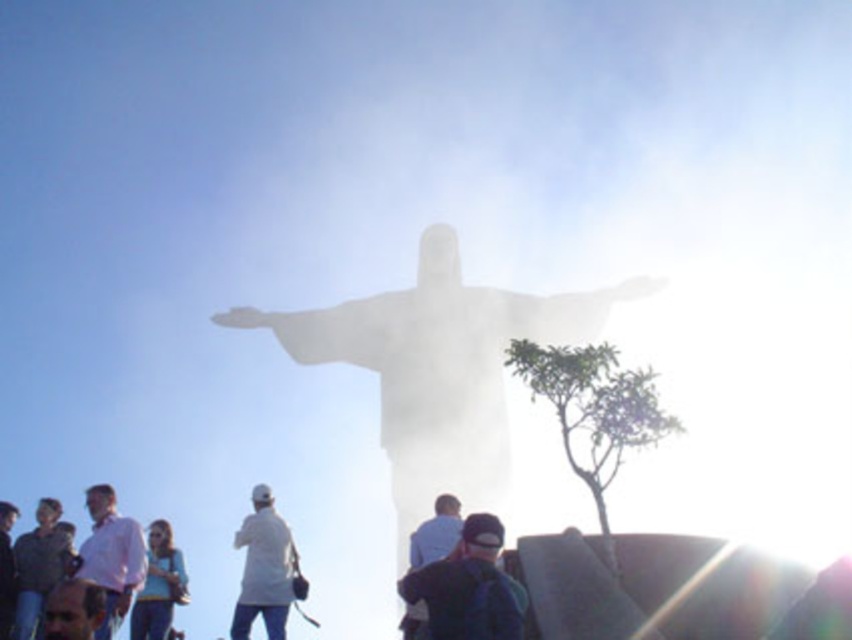
Between point (249, 554) and point (412, 625), which one is positioned in front?

Point (412, 625)

Is white matte jacket at center positioned before light blue shirt at center?

No, it is not.

Does point (278, 625) come closer to viewer compared to point (436, 524)?

No.

Find the location of a particular element. The width and height of the screenshot is (852, 640). white matte jacket at center is located at coordinates (263, 568).

Is pink matte shirt at lower left bigger than light blue shirt at center?

No, pink matte shirt at lower left is not bigger than light blue shirt at center.

Does pink matte shirt at lower left have a greater width compared to light blue shirt at center?

Yes.

Describe the element at coordinates (111, 556) in the screenshot. I see `pink matte shirt at lower left` at that location.

Locate an element on the screen. The height and width of the screenshot is (640, 852). pink matte shirt at lower left is located at coordinates (111, 556).

Based on the photo, is dark blue fabric cap at lower center below pink matte shirt at lower left?

Yes, dark blue fabric cap at lower center is below pink matte shirt at lower left.

Is point (507, 600) farther from camera compared to point (130, 573)?

That is False.

I want to click on dark blue fabric cap at lower center, so click(x=469, y=588).